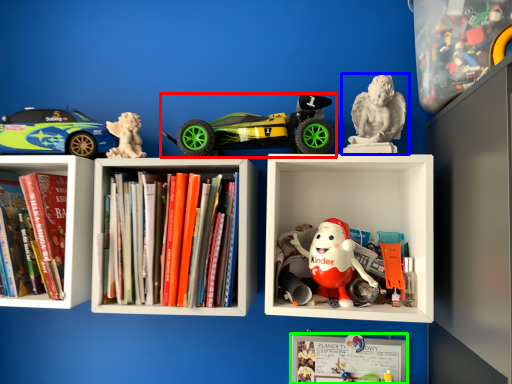
Question: Considering the real-world distances, which object is farthest from toy (highlighted by a red box)? toy (highlighted by a blue box) or bulletin board (highlighted by a green box)?

Choices:
 (A) toy
 (B) bulletin board

Answer: (B)